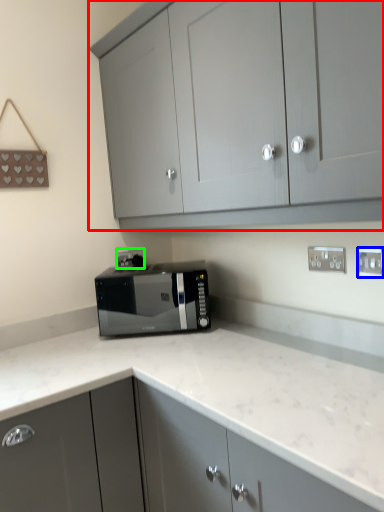
Question: Considering the real-world distances, which object is closest to cabinetry (highlighted by a red box)? electric outlet (highlighted by a blue box) or electric outlet (highlighted by a green box).

Choices:
 (A) electric outlet
 (B) electric outlet

Answer: (A)